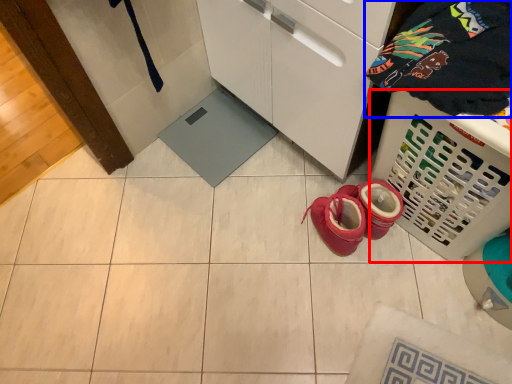
Question: Among these objects, which one is farthest to the camera, basket (highlighted by a red box) or clothing (highlighted by a blue box)?

Choices:
 (A) basket
 (B) clothing

Answer: (A)